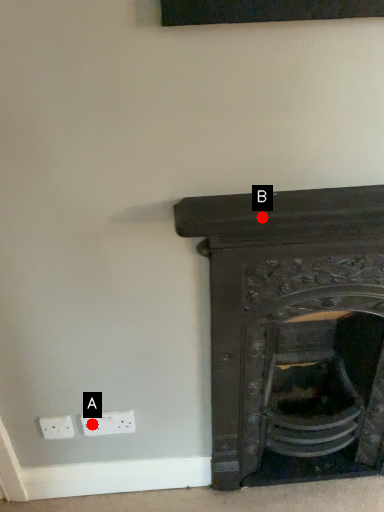
Question: Two points are circled on the image, labeled by A and B beside each circle. Which point appears farthest from the camera in this image?

Choices:
 (A) A is further
 (B) B is further

Answer: (A)